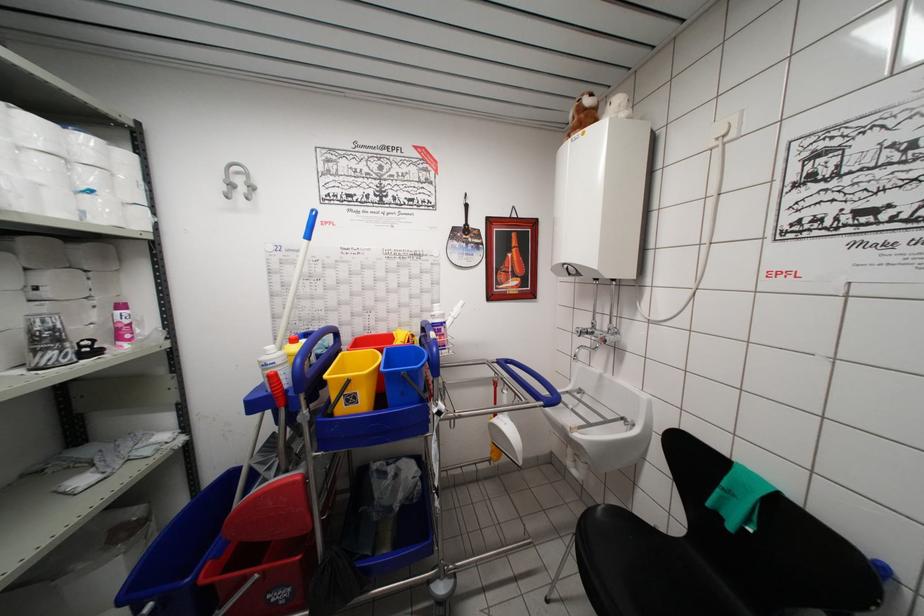
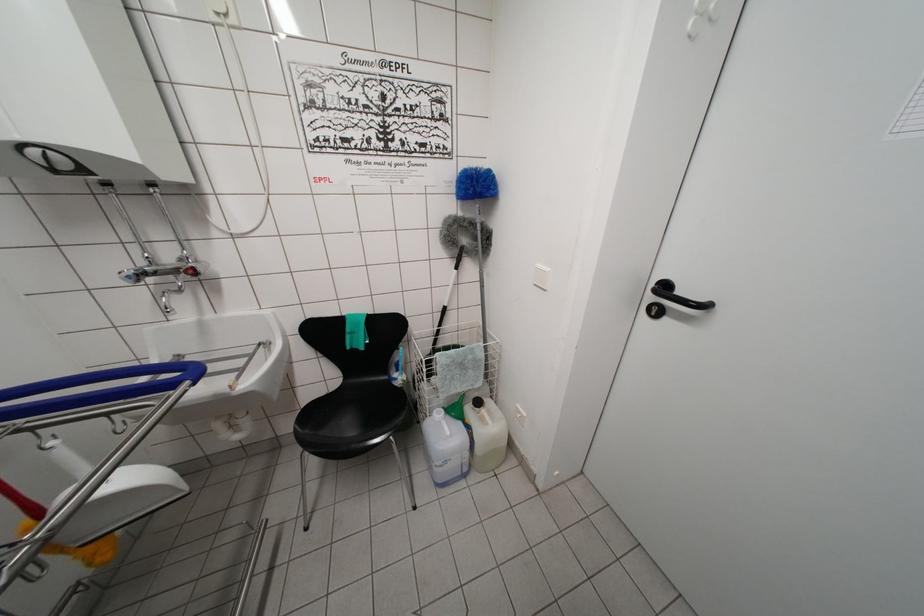
The point at (x=608, y=339) is marked in the first image. Where is the corresponding point in the second image?

(193, 270)